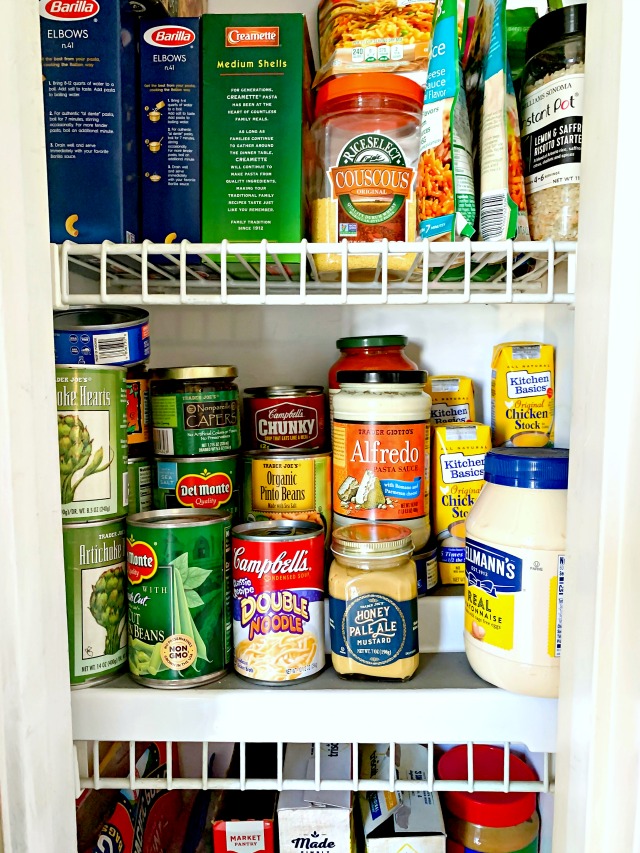
Where is `items on the bottom shelf`? This screenshot has height=853, width=640. items on the bottom shelf is located at coordinates (125, 825), (173, 828), (233, 833), (317, 836), (413, 825), (474, 832).